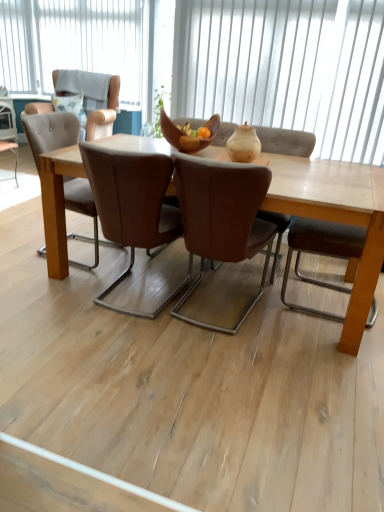
Identify the location of vacant region to the left of brown leather chair at center, the 2th chair positioned from the right. The height and width of the screenshot is (512, 384). (62, 287).